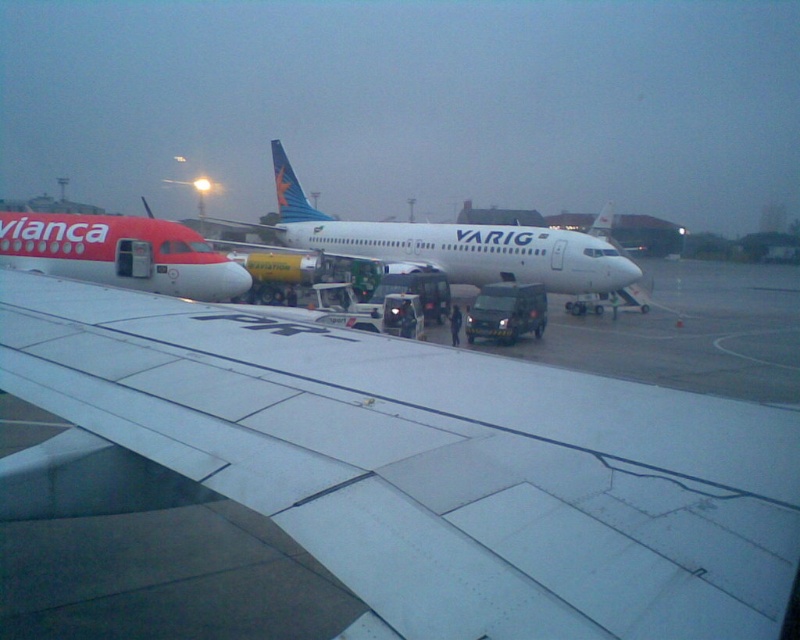
Which is below, white matte wing at center or white glossy airplane at center?

white matte wing at center

What do you see at coordinates (436, 465) in the screenshot? I see `white matte wing at center` at bounding box center [436, 465].

Where is `white matte wing at center`? white matte wing at center is located at coordinates (436, 465).

Can you confirm if white matte wing at center is taller than matte red airplane at left?

In fact, white matte wing at center may be shorter than matte red airplane at left.

Identify the location of white matte wing at center. (436, 465).

The height and width of the screenshot is (640, 800). I want to click on white matte wing at center, so click(436, 465).

Is white glossy airplane at center wider than matte red airplane at left?

Correct, the width of white glossy airplane at center exceeds that of matte red airplane at left.

Is point (458, 236) more distant than point (78, 220)?

Yes, point (458, 236) is behind point (78, 220).

Image resolution: width=800 pixels, height=640 pixels. Find the location of `white glossy airplane at center`. white glossy airplane at center is located at coordinates tap(456, 244).